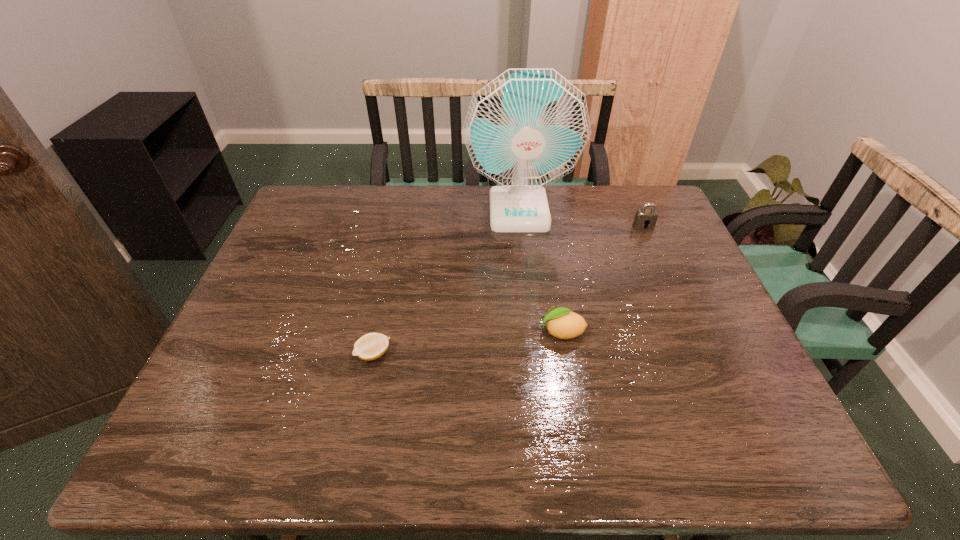
You are a GUI agent. You are given a task and a screenshot of the screen. Output one action in this format:
    pyautogui.click(x=<x>, y=<y>)
    Task: Click on the fan
    This screenshot has width=960, height=540.
    Given the screenshot: What is the action you would take?
    pyautogui.click(x=527, y=128)

The width and height of the screenshot is (960, 540). What are the coordinates of `padlock` in the screenshot? It's located at (645, 219).

This screenshot has height=540, width=960. In order to click on the taller lemon in this screenshot , I will do `click(562, 323)`.

I want to click on the right lemon, so [x=562, y=323].

Image resolution: width=960 pixels, height=540 pixels. What are the coordinates of `the shorter lemon` in the screenshot? It's located at (371, 346).

Locate an element on the screen. This screenshot has width=960, height=540. the left lemon is located at coordinates (371, 346).

The height and width of the screenshot is (540, 960). I want to click on vacant space located 0.240m in front of the fan to face the airflow, so click(x=527, y=289).

You are a GUI agent. You are given a task and a screenshot of the screen. Output one action in this format:
    pyautogui.click(x=<x>, y=<y>)
    Task: Click on the vacant position located at the front of the padlock near the keyhole
    
    Given the screenshot: What is the action you would take?
    pyautogui.click(x=674, y=299)

Locate an element on the screen. vacant area situated 0.080m with leaves positioned above the third tallest object is located at coordinates tap(505, 332).

The image size is (960, 540). Find the location of `free space located with leaves positioned above the third tallest object`. free space located with leaves positioned above the third tallest object is located at coordinates (485, 332).